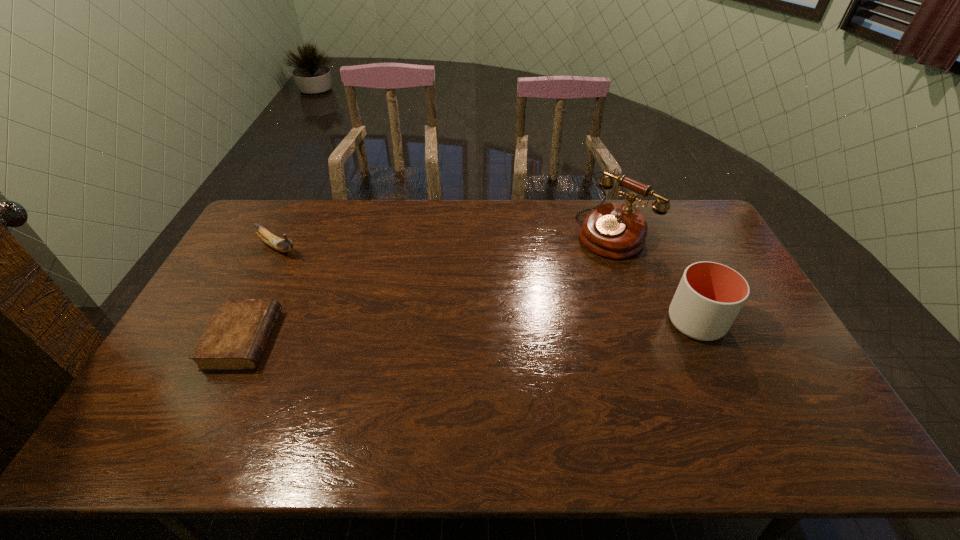
Identify the location of free spot at the left edge of the desktop. (197, 335).

In the image, there is a desktop. What are the coordinates of `vacant space at the right edge` in the screenshot? It's located at (746, 336).

In the image, there is a desktop. Where is `free region at the far left corner`? Image resolution: width=960 pixels, height=540 pixels. free region at the far left corner is located at coordinates (281, 235).

This screenshot has width=960, height=540. I want to click on free space between the tallest object and the diary, so click(429, 286).

I want to click on free space between the tallest object and the cup, so click(x=656, y=277).

At what (x,y) coordinates should I click in order to perform the action: click on empty space that is in between the third tallest object and the tallest object. Please return your answer as a coordinate pair (x, y). The height and width of the screenshot is (540, 960). Looking at the image, I should click on (446, 240).

At what (x,y) coordinates should I click in order to perform the action: click on free space between the diary and the telephone. Please return your answer as a coordinate pair (x, y). The width and height of the screenshot is (960, 540). Looking at the image, I should click on (429, 286).

You are a GUI agent. You are given a task and a screenshot of the screen. Output one action in this format:
    pyautogui.click(x=<x>, y=<y>)
    Task: Click on the free space between the tallest object and the diary
    This screenshot has width=960, height=540.
    Given the screenshot: What is the action you would take?
    pyautogui.click(x=429, y=286)

This screenshot has width=960, height=540. What are the coordinates of `vacant region between the tallest object and the banana` in the screenshot? It's located at (446, 240).

You are a GUI agent. You are given a task and a screenshot of the screen. Output one action in this format:
    pyautogui.click(x=<x>, y=<y>)
    Task: Click on the unoccupied area between the shortest object and the second shortest object
    This screenshot has width=960, height=540.
    Given the screenshot: What is the action you would take?
    pyautogui.click(x=260, y=294)